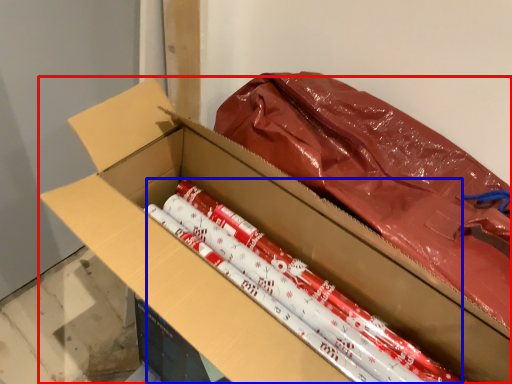
Question: Among these objects, which one is nearest to the camera, box (highlighted by a red box) or crayon (highlighted by a blue box)?

Choices:
 (A) box
 (B) crayon

Answer: (A)